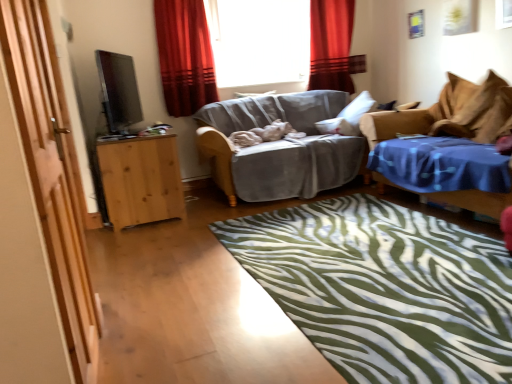
The width and height of the screenshot is (512, 384). What are the coordinates of `vacant space in front of light brown wooden cabinet at left` in the screenshot? It's located at (147, 236).